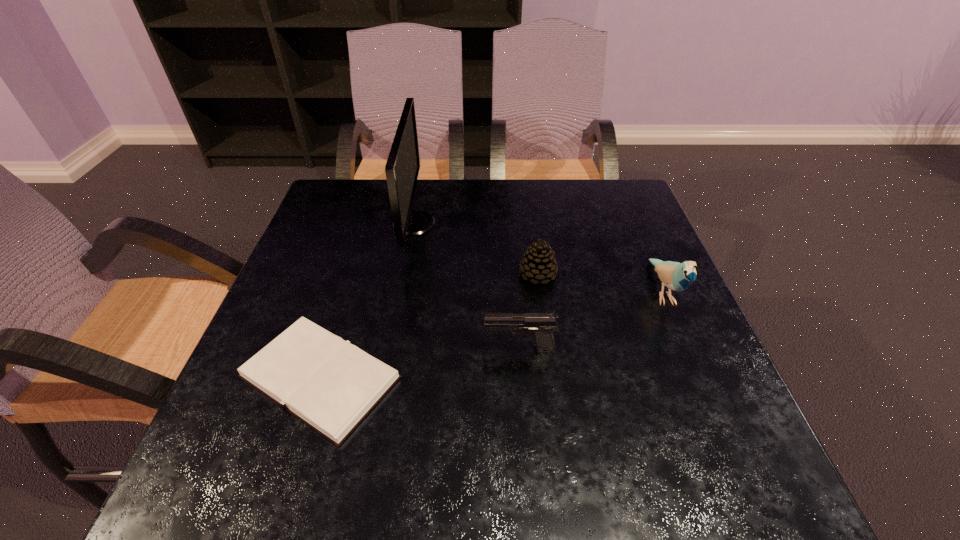
This screenshot has height=540, width=960. What are the coordinates of `empty space that is in between the pistol and the tallest object` in the screenshot? It's located at (467, 286).

This screenshot has width=960, height=540. What are the coordinates of `empty location between the computer monitor and the pinecone` in the screenshot? It's located at (476, 248).

You are a GUI agent. You are given a task and a screenshot of the screen. Output one action in this format:
    pyautogui.click(x=<x>, y=<y>)
    Task: Click on the free area in between the bird and the hardback book
    This screenshot has width=960, height=540.
    Given the screenshot: What is the action you would take?
    pyautogui.click(x=492, y=334)

This screenshot has width=960, height=540. Identify the location of vacant space in between the pistol and the shortest object. (420, 363).

What are the coordinates of `vacant area that lies between the hardback book and the pistol` in the screenshot? It's located at (420, 363).

Image resolution: width=960 pixels, height=540 pixels. In order to click on vacant area that lies between the computer monitor and the hardback book in this screenshot , I will do (x=367, y=300).

Locate which object is the third closest to the hardback book. Please provide its 2D coordinates. Your answer should be formatted as a tuple, i.e. [(x, y)], where the tuple contains the x and y coordinates of a point satisfying the conditions above.

[(539, 263)]

Image resolution: width=960 pixels, height=540 pixels. In order to click on object that is the closest to the pistol in this screenshot , I will do `click(331, 385)`.

Find the location of a particular element. free space that satisfies the following two spatial constraints: 1. aim along the barrel of the pistol; 2. on the front side of the hardback book is located at coordinates (521, 377).